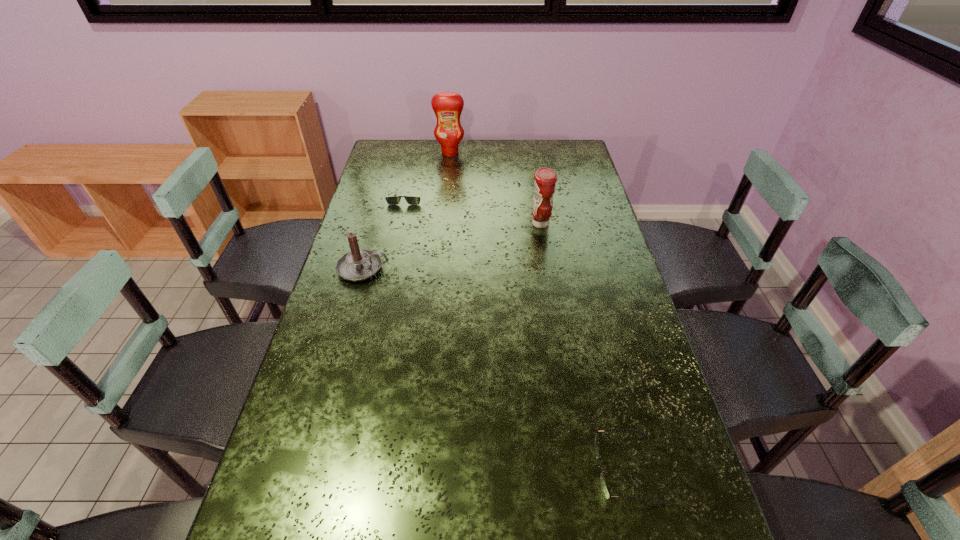
At what (x,y) coordinates should I click in order to perform the action: click on vacant space at the left edge of the desktop. Please return your answer as a coordinate pair (x, y). This screenshot has width=960, height=540. Looking at the image, I should click on (361, 300).

Identify the location of vacant space at the right edge. (597, 384).

Find the location of `vacant space at the far right corner of the desktop`. vacant space at the far right corner of the desktop is located at coordinates (569, 158).

This screenshot has height=540, width=960. Find the location of `vacant area between the left condiment and the nearer condiment`. vacant area between the left condiment and the nearer condiment is located at coordinates (495, 188).

Identify the location of vacant space that's between the nearest object and the second nearest object. (494, 369).

This screenshot has width=960, height=540. What are the coordinates of `free spot between the spectacles and the third nearest object` in the screenshot? It's located at (584, 346).

In order to click on free spot between the second tallest object and the second farthest object in this screenshot , I will do `click(473, 210)`.

At what (x,y) coordinates should I click in order to perform the action: click on vacant area between the spectacles and the candle. Please return your answer as a coordinate pair (x, y). Looking at the image, I should click on (494, 369).

This screenshot has width=960, height=540. Find the location of `vacant area that lies between the second nearest object and the shorter condiment`. vacant area that lies between the second nearest object and the shorter condiment is located at coordinates (451, 246).

This screenshot has width=960, height=540. Identify the location of vacant space that's between the sunglasses and the nearest object. (516, 332).